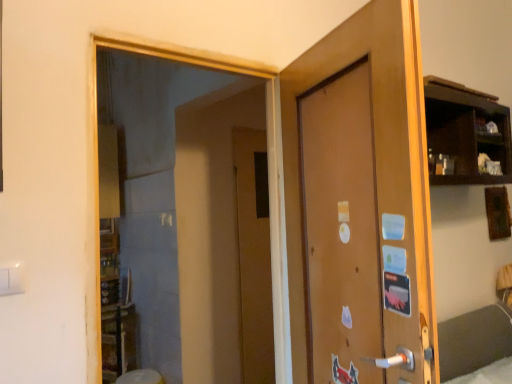
Question: From the image's perspective, is brown matte door at center, acting as the 2th door starting from the front, on brown matte door at center, which appears as the first door when viewed from the front?

Choices:
 (A) yes
 (B) no

Answer: (B)

Question: Can you confirm if brown matte door at center, acting as the first door starting from the back, is positioned to the right of brown matte door at center, which appears as the first door when viewed from the front?

Choices:
 (A) no
 (B) yes

Answer: (A)

Question: Is brown matte door at center, acting as the 2th door starting from the front, aimed at brown matte door at center, which is the 2th door in back-to-front order?

Choices:
 (A) yes
 (B) no

Answer: (B)

Question: Does brown matte door at center, acting as the first door starting from the back, come behind brown matte door at center, which is the 2th door in back-to-front order?

Choices:
 (A) yes
 (B) no

Answer: (A)

Question: From the image's perspective, would you say brown matte door at center, acting as the 2th door starting from the front, is shown under brown matte door at center, which is the 2th door in back-to-front order?

Choices:
 (A) yes
 (B) no

Answer: (A)

Question: In the image, is brown matte door at center, acting as the first door starting from the back, positioned in front of or behind brown matte door at center, which is the 2th door in back-to-front order?

Choices:
 (A) front
 (B) behind

Answer: (B)

Question: Considering the positions of brown matte door at center, acting as the 2th door starting from the front, and brown matte door at center, which is the 2th door in back-to-front order, in the image, is brown matte door at center, acting as the 2th door starting from the front, wider or thinner than brown matte door at center, which is the 2th door in back-to-front order,?

Choices:
 (A) thin
 (B) wide

Answer: (A)

Question: In terms of height, does brown matte door at center, acting as the first door starting from the back, look taller or shorter compared to brown matte door at center, which is the 2th door in back-to-front order?

Choices:
 (A) short
 (B) tall

Answer: (B)

Question: From the image's perspective, relative to brown matte door at center, which is the 2th door in back-to-front order, is brown matte door at center, acting as the 2th door starting from the front, above or below?

Choices:
 (A) below
 (B) above

Answer: (A)

Question: From their relative heights in the image, would you say brown matte door at center, acting as the 2th door starting from the front, is taller or shorter than transparent glass mirror at upper left?

Choices:
 (A) tall
 (B) short

Answer: (A)

Question: In terms of size, does brown matte door at center, acting as the first door starting from the back, appear bigger or smaller than transparent glass mirror at upper left?

Choices:
 (A) big
 (B) small

Answer: (B)

Question: Considering the relative positions of brown matte door at center, acting as the first door starting from the back, and transparent glass mirror at upper left in the image provided, is brown matte door at center, acting as the first door starting from the back, to the left or to the right of transparent glass mirror at upper left?

Choices:
 (A) left
 (B) right

Answer: (B)

Question: Is brown matte door at center, acting as the 2th door starting from the front, in front of or behind transparent glass mirror at upper left in the image?

Choices:
 (A) front
 (B) behind

Answer: (B)

Question: Is brown matte door at center, which appears as the first door when viewed from the front, taller or shorter than brown matte door at center, acting as the 2th door starting from the front?

Choices:
 (A) tall
 (B) short

Answer: (B)

Question: From a real-world perspective, is brown matte door at center, which is the 2th door in back-to-front order, physically located above or below brown matte door at center, acting as the 2th door starting from the front?

Choices:
 (A) below
 (B) above

Answer: (B)